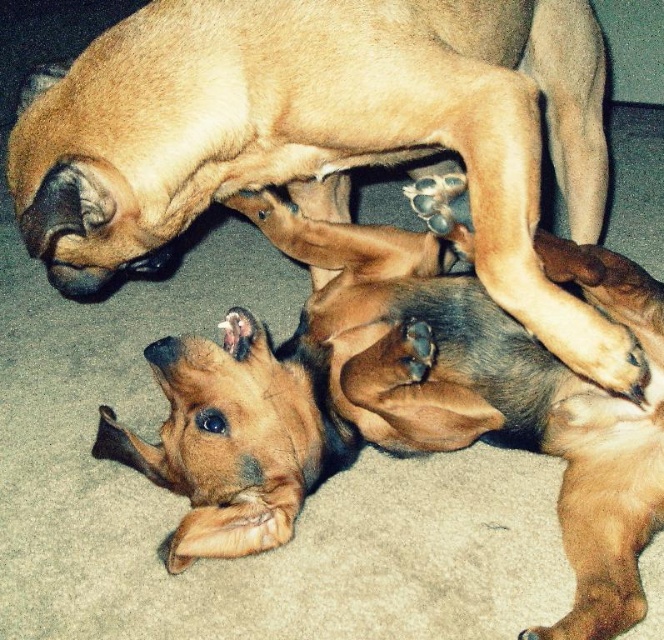
You are a photographer trying to capture a photo of both the brown matte dog at center and the brown furry dog at lower center. Since you want to ensure both are in frame, can you determine which dog is on the right side of the other?

The brown matte dog at center is positioned on the right side of the brown furry dog at lower center, so the brown matte dog at center is on the right side of the brown furry dog at lower center.

You are standing in front of the two dogs and want to take a photo of the point at coordinate point (268,141). If your camera has a focal length of 50mm and you are 4.21 feet away from the point, will you need to adjust your camera position to ensure the point is in focus?

The point at coordinate point (268,141) is exactly 4.21 feet away from the camera, so no adjustment is needed as the camera is already at the correct distance to focus on the point.